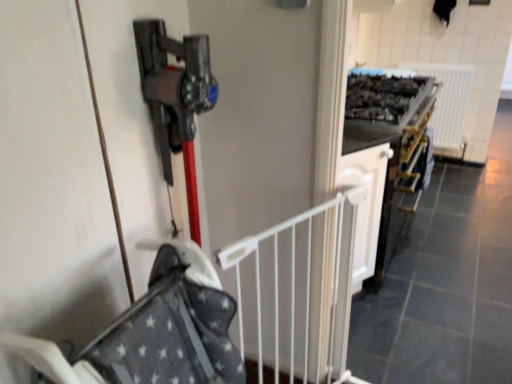
Question: Is white metal gate at center facing away from white glossy cabinet at center?

Choices:
 (A) yes
 (B) no

Answer: (B)

Question: Are white metal gate at center and white glossy cabinet at center far apart?

Choices:
 (A) yes
 (B) no

Answer: (B)

Question: Is the surface of white metal gate at center in direct contact with white glossy cabinet at center?

Choices:
 (A) no
 (B) yes

Answer: (A)

Question: Is white metal gate at center aimed at white glossy cabinet at center?

Choices:
 (A) yes
 (B) no

Answer: (B)

Question: Is white metal gate at center completely or partially outside of white glossy cabinet at center?

Choices:
 (A) yes
 (B) no

Answer: (A)

Question: Is white metal gate at center bigger than white glossy cabinet at center?

Choices:
 (A) no
 (B) yes

Answer: (A)

Question: Is gray fabric baby carriage at center oriented towards white glossy cabinet at center?

Choices:
 (A) no
 (B) yes

Answer: (A)

Question: Does gray fabric baby carriage at center have a lesser width compared to white glossy cabinet at center?

Choices:
 (A) yes
 (B) no

Answer: (B)

Question: Is gray fabric baby carriage at center to the left of white glossy cabinet at center from the viewer's perspective?

Choices:
 (A) no
 (B) yes

Answer: (B)

Question: Is gray fabric baby carriage at center surrounding white glossy cabinet at center?

Choices:
 (A) yes
 (B) no

Answer: (B)

Question: Considering the relative sizes of gray fabric baby carriage at center and white glossy cabinet at center in the image provided, is gray fabric baby carriage at center smaller than white glossy cabinet at center?

Choices:
 (A) no
 (B) yes

Answer: (A)

Question: From the image's perspective, is gray fabric baby carriage at center on white glossy cabinet at center?

Choices:
 (A) no
 (B) yes

Answer: (A)

Question: Considering the relative sizes of gray fabric baby carriage at center and white plastic radiator at upper right in the image provided, is gray fabric baby carriage at center bigger than white plastic radiator at upper right?

Choices:
 (A) yes
 (B) no

Answer: (A)